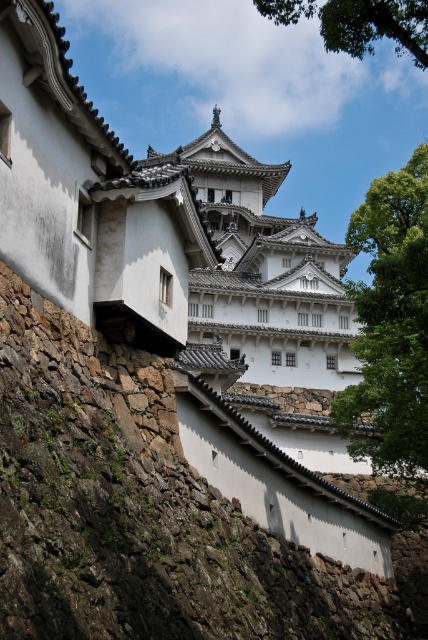
You are standing at the base of the white stone tower at center at Himeji Castle. You want to take a photo of the tower from a distance where the entire structure fits in the frame. If your camera can capture a maximum width of 30 meters, will you be able to take the photo from your current position?

The white stone tower at center and camera are 39.96 meters apart. Since the camera can only capture a maximum width of 30 meters, the distance is too far to capture the entire tower in the frame. You need to move closer.

Looking at this image, you are standing at the entrance of Himeji Castle and want to locate the green leafy tree at right. According to the coordinates provided, where should you look relative to the castle?

The green leafy tree at right is located at coordinates point [391,323], which means it is positioned near the bottom right corner of the image relative to the castle.

You are a tourist visiting Himeji Castle and want to take a photo that includes both the white stone tower at center and the green leafy tree at upper center. Which object should you position closer to the camera to ensure both are in the frame?

To include both the white stone tower at center and the green leafy tree at upper center in the photo, position the green leafy tree at upper center closer to the camera since it is larger than the white stone tower at center. This will help balance their sizes in the frame.